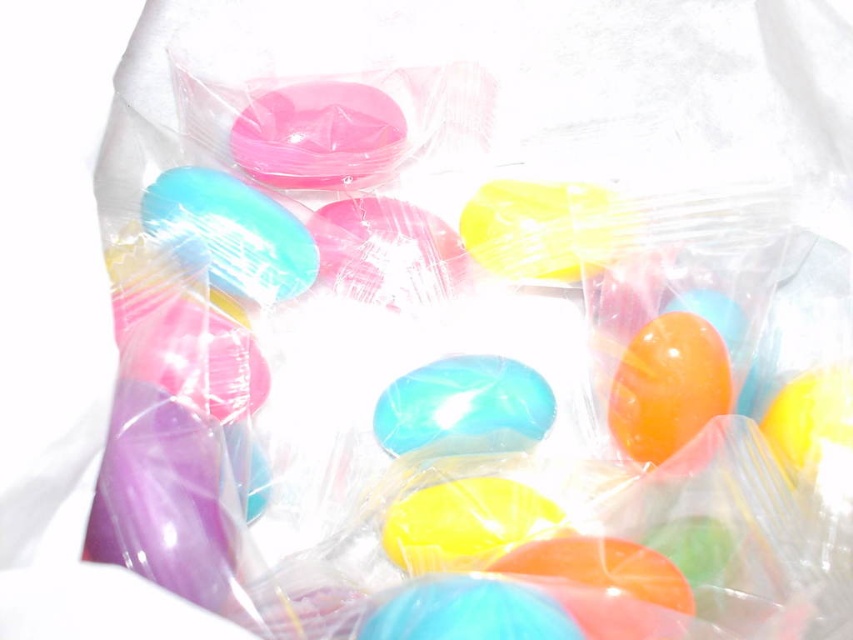
Question: Does matte pink candy at upper center come in front of translucent glossy jelly bean at center?

Choices:
 (A) no
 (B) yes

Answer: (A)

Question: Can you confirm if matte pink candy at upper center is bigger than translucent glossy jelly bean at center?

Choices:
 (A) no
 (B) yes

Answer: (B)

Question: Which point appears farthest from the camera in this image?

Choices:
 (A) (343, 83)
 (B) (378, 433)

Answer: (A)

Question: Is matte pink candy at upper center to the left of translucent glossy jelly bean at center from the viewer's perspective?

Choices:
 (A) yes
 (B) no

Answer: (A)

Question: Which point is closer to the camera?

Choices:
 (A) (476, 429)
 (B) (372, 125)

Answer: (A)